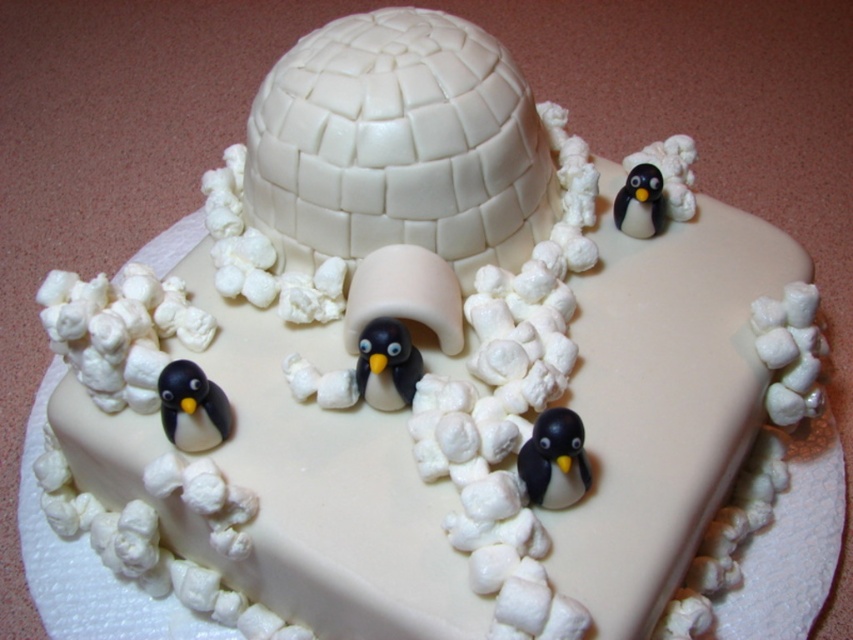
You are a guest at a birthday party and see the cake with the matte black penguin at center. If you want to place a cherry on the cake exactly where the penguin is, can you do it without moving the penguin?

The matte black penguin at center is located at point [387,364], so placing a cherry exactly at that coordinate would require moving the penguin first since they can occupy the same spot.

You are a guest at a winter themed birthday party and you want to take a piece of cake that has both the black matte penguin at lower left and the matte black penguin at center. Which penguin should you cut closer to the bottom of the cake?

The black matte penguin at lower left is below the matte black penguin at center, so you should cut closer to the bottom of the cake near the black matte penguin at lower left.

You are a guest at a birthday party and want to take a photo of both the matte black penguin at center and the black glossy penguin at upper right. Which penguin should you focus on first to ensure both are in focus?

You should focus on the matte black penguin at center first because it is closer to the viewer than the black glossy penguin at upper right. By focusing on the closer penguin, the farther one will also be in focus due to the depth of field.